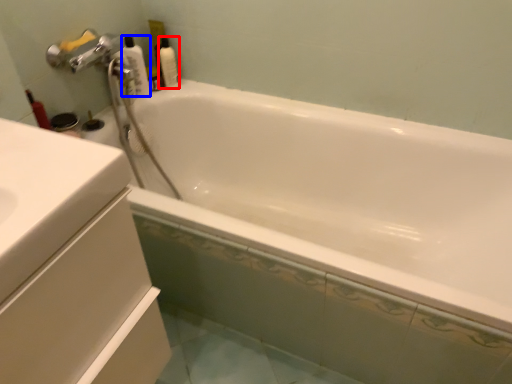
Question: Which object appears closest to the camera in this image, cleaning product (highlighted by a red box) or cleaning product (highlighted by a blue box)?

Choices:
 (A) cleaning product
 (B) cleaning product

Answer: (B)